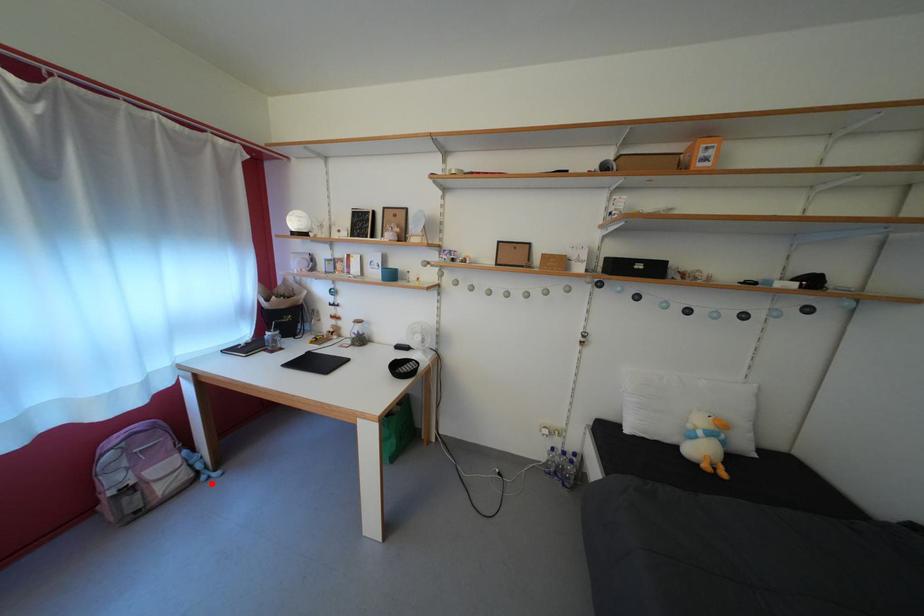
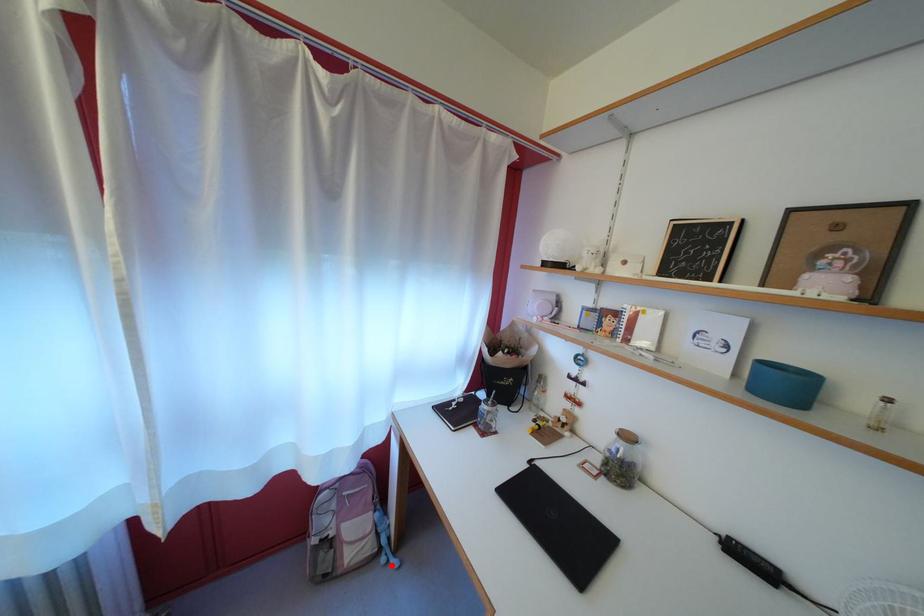
I am providing you with two images of the same scene from different viewpoints. A red point is marked on the first image and another point is marked on the second image. Do the highlighted points in image1 and image2 indicate the same real-world spot?

Yes